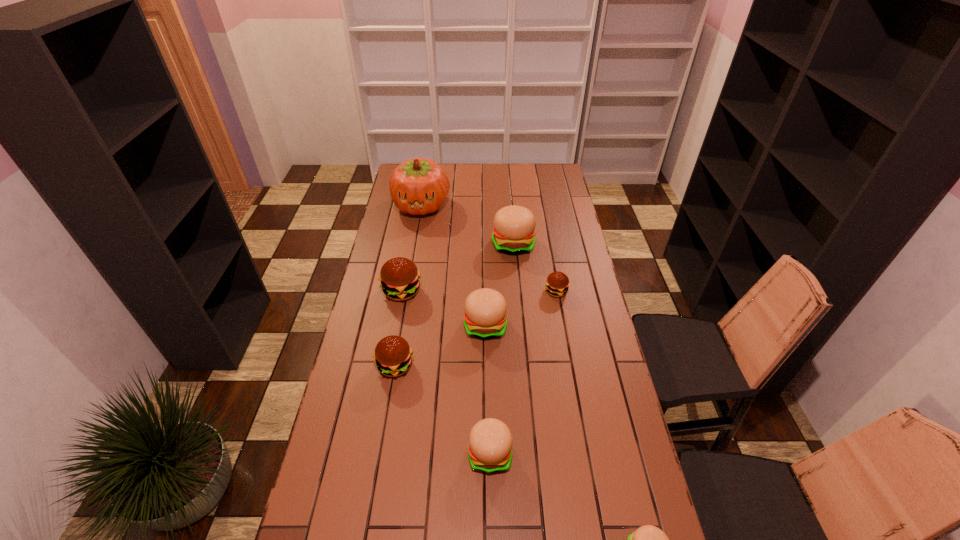
The width and height of the screenshot is (960, 540). Identify the location of vacant space that satisfies the following two spatial constraints: 1. on the back side of the biggest brown hamburger; 2. on the left side of the farthest beige hamburger. (411, 244).